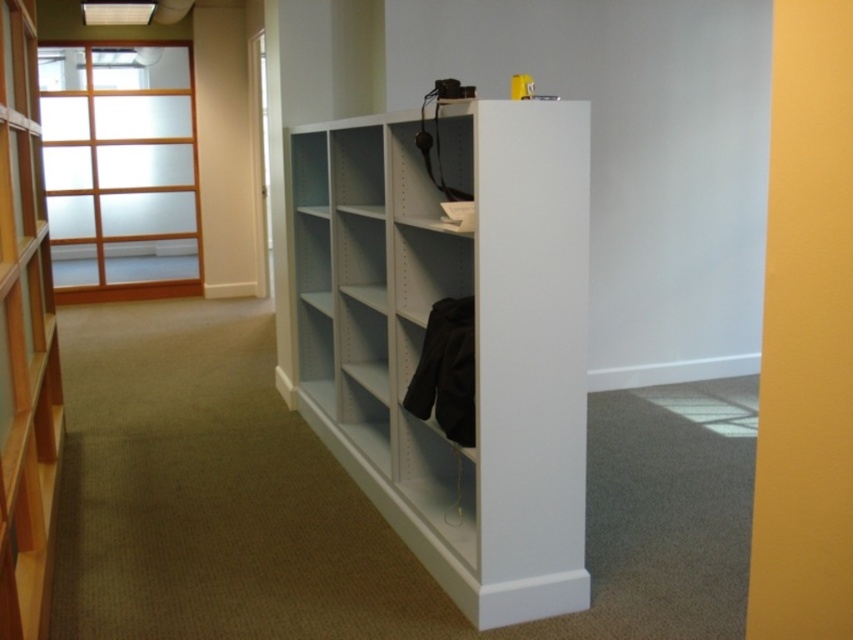
You are standing in the office and need to place a new monitor that requires 12 feet of space between the viewing area and the screen. Is the point at coordinates point (332, 163) suitable for placing the monitor?

Result: The distance of point (332, 163) from viewer is 11.39 feet, which is less than the required 12 feet. Therefore, the point at coordinates point (332, 163) is not suitable for placing the monitor.

You are an office worker who needs to place a tall document box on a bookshelf. The box is 1.2 meters in height. Which bookshelf, the white matte bookshelf at center or the light brown wood bookshelf at left, can accommodate the box without it exceeding the shelf height?

The light brown wood bookshelf at left is taller than the white matte bookshelf at center. Since the box is 1.2 meters tall, the light brown wood bookshelf at left is the better option as it can accommodate the height of the box without exceeding its limits.

You are organizing a library and need to place a large book collection. Which bookshelf should you choose between the white matte bookshelf at center and the light brown wood bookshelf at left if you want to maximize storage capacity?

The light brown wood bookshelf at left is larger in size, making it better suited for maximizing storage capacity for the large book collection.